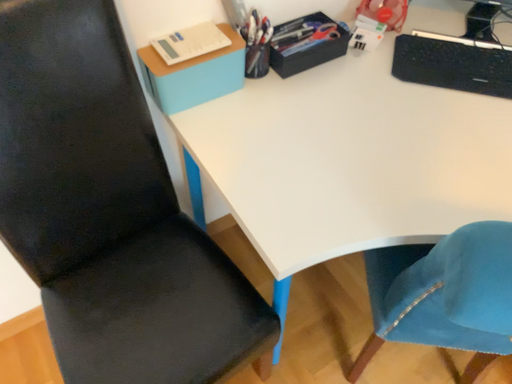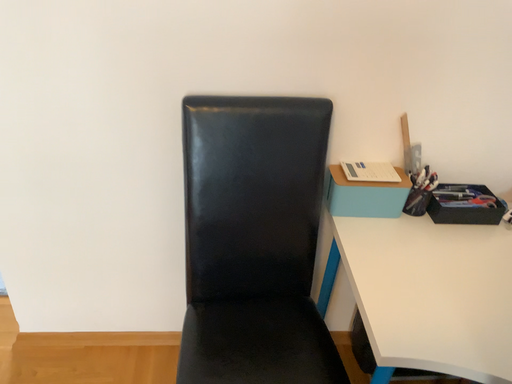
Question: Which way did the camera rotate in the video?

Choices:
 (A) rotated upward
 (B) rotated downward

Answer: (A)